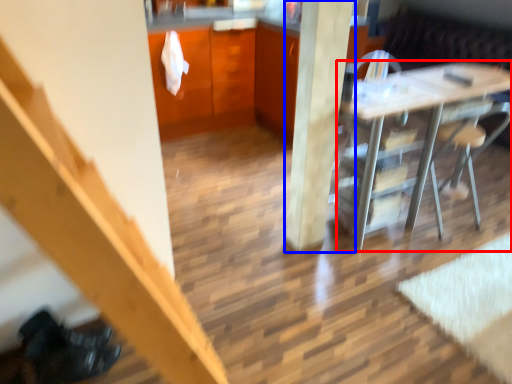
Question: Among these objects, which one is farthest to the camera, desk (highlighted by a red box) or pillar (highlighted by a blue box)?

Choices:
 (A) desk
 (B) pillar

Answer: (A)